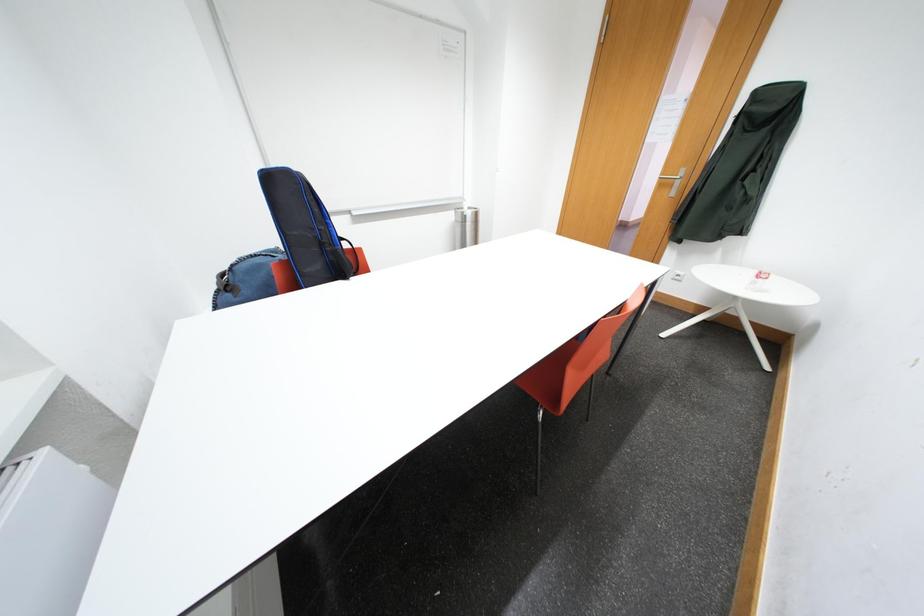
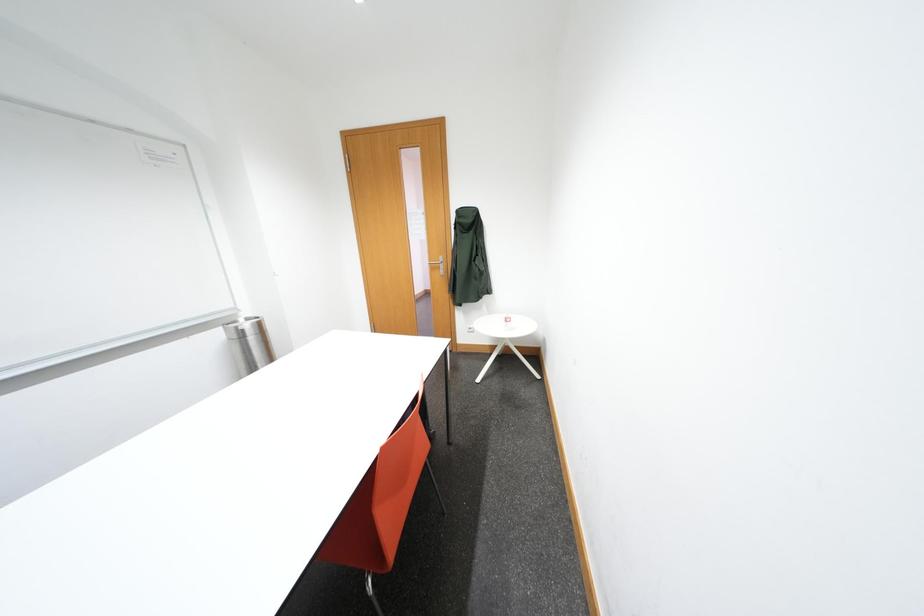
Question: The camera is either moving clockwise (left) or counter-clockwise (right) around the object. The first image is from the beginning of the video and the second image is from the end. Is the camera moving left or right when shooting the video?

Choices:
 (A) Left
 (B) Right

Answer: (A)